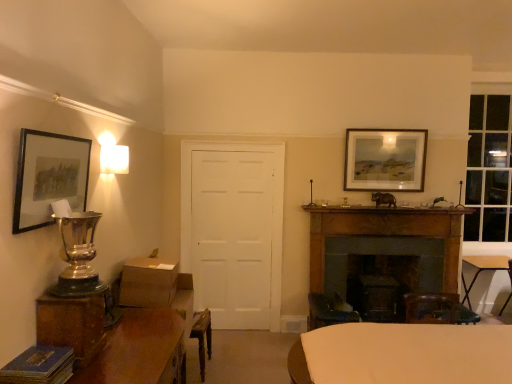
Question: Should I look upward or downward to see matte black picture frame at upper left, marked as the second picture frame in a right-to-left arrangement?

Choices:
 (A) up
 (B) down

Answer: (A)

Question: From the image's perspective, is matte black picture frame at upper left, which ranks as the 2th picture frame in back-to-front order, above dark brown wood fireplace at center right?

Choices:
 (A) no
 (B) yes

Answer: (B)

Question: From a real-world perspective, is matte black picture frame at upper left, which is the first picture frame from left to right, physically above dark brown wood fireplace at center right?

Choices:
 (A) no
 (B) yes

Answer: (B)

Question: Is matte black picture frame at upper left, the 1th picture frame viewed from the front, touching dark brown wood fireplace at center right?

Choices:
 (A) yes
 (B) no

Answer: (B)

Question: Would you consider matte black picture frame at upper left, which ranks as the 2th picture frame in back-to-front order, to be distant from dark brown wood fireplace at center right?

Choices:
 (A) yes
 (B) no

Answer: (A)

Question: Is dark brown wood fireplace at center right inside matte black picture frame at upper left, marked as the second picture frame in a right-to-left arrangement?

Choices:
 (A) no
 (B) yes

Answer: (A)

Question: Does matte black picture frame at upper left, marked as the second picture frame in a right-to-left arrangement, have a lesser height compared to dark brown wood fireplace at center right?

Choices:
 (A) yes
 (B) no

Answer: (A)

Question: Does white matte door at center have a larger size compared to white fabric-covered table at center, placed as the second table when sorted from back to front?

Choices:
 (A) yes
 (B) no

Answer: (B)

Question: Would you say white matte door at center contains white fabric-covered table at center, the second table in the front-to-back sequence?

Choices:
 (A) no
 (B) yes

Answer: (A)

Question: Considering the relative sizes of white matte door at center and white fabric-covered table at center, which is counted as the 2th table, starting from the right, in the image provided, is white matte door at center shorter than white fabric-covered table at center, which is counted as the 2th table, starting from the right,?

Choices:
 (A) yes
 (B) no

Answer: (B)

Question: Does white matte door at center turn towards white fabric-covered table at center, the 2th table positioned from the left?

Choices:
 (A) yes
 (B) no

Answer: (B)

Question: Does white matte door at center appear on the left side of white fabric-covered table at center, the 2th table positioned from the left?

Choices:
 (A) no
 (B) yes

Answer: (B)

Question: From a real-world perspective, is white matte door at center beneath white fabric-covered table at center, the 2th table positioned from the left?

Choices:
 (A) yes
 (B) no

Answer: (B)

Question: From the image's perspective, would you say wooden table at lower left, arranged as the 3th table when viewed from the back, is shown under white matte door at center?

Choices:
 (A) no
 (B) yes

Answer: (B)